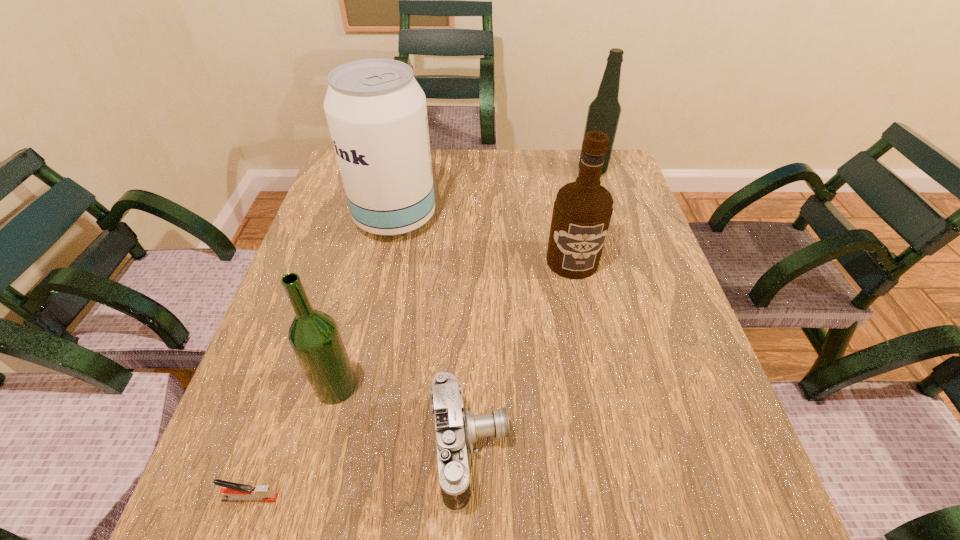
The height and width of the screenshot is (540, 960). I want to click on vacant space located at the lens of the fourth object from left to right, so click(x=673, y=449).

Where is `free space located 0.170m on the handle side of the stapler`? This screenshot has height=540, width=960. free space located 0.170m on the handle side of the stapler is located at coordinates [385, 498].

Where is `object located in the far edge section of the desktop`? This screenshot has height=540, width=960. object located in the far edge section of the desktop is located at coordinates (604, 111).

The height and width of the screenshot is (540, 960). I want to click on camera that is at the near edge, so click(x=456, y=428).

You are a GUI agent. You are given a task and a screenshot of the screen. Output one action in this format:
    pyautogui.click(x=<x>, y=<y>)
    Task: Click on the stapler that is at the near edge
    The width and height of the screenshot is (960, 540).
    Given the screenshot: What is the action you would take?
    pyautogui.click(x=233, y=491)

Where is `stapler located in the left edge section of the desktop`? The image size is (960, 540). stapler located in the left edge section of the desktop is located at coordinates point(233,491).

The width and height of the screenshot is (960, 540). I want to click on object located at the near left corner, so click(x=233, y=491).

Identify the location of object present at the far right corner. The width and height of the screenshot is (960, 540). (604, 111).

Where is `vacant area at the far edge of the desktop`? vacant area at the far edge of the desktop is located at coordinates (553, 176).

I want to click on vacant region at the left edge of the desktop, so click(x=270, y=349).